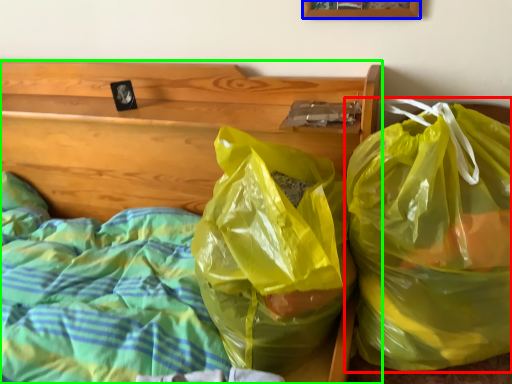
Question: Which object is the closest to the plastic bag (highlighted by a red box)? Choose among these: picture frame (highlighted by a blue box) or furniture (highlighted by a green box).

Choices:
 (A) picture frame
 (B) furniture

Answer: (B)